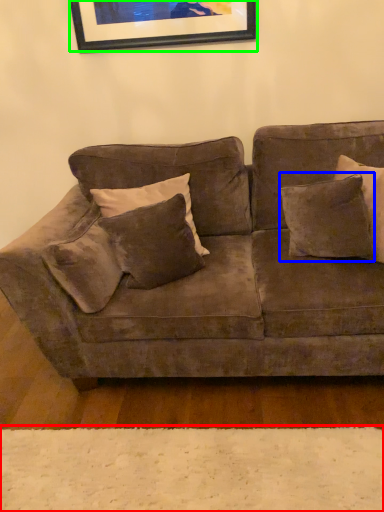
Question: Which is farther away from plain (highlighted by a red box)? pillow (highlighted by a blue box) or picture frame (highlighted by a green box)?

Choices:
 (A) pillow
 (B) picture frame

Answer: (B)